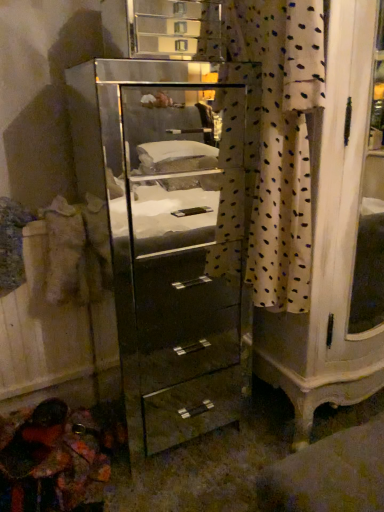
This screenshot has height=512, width=384. Find the location of `vacant point to the right of mirror-finished glass chest of drawers at center`. vacant point to the right of mirror-finished glass chest of drawers at center is located at coordinates (268, 424).